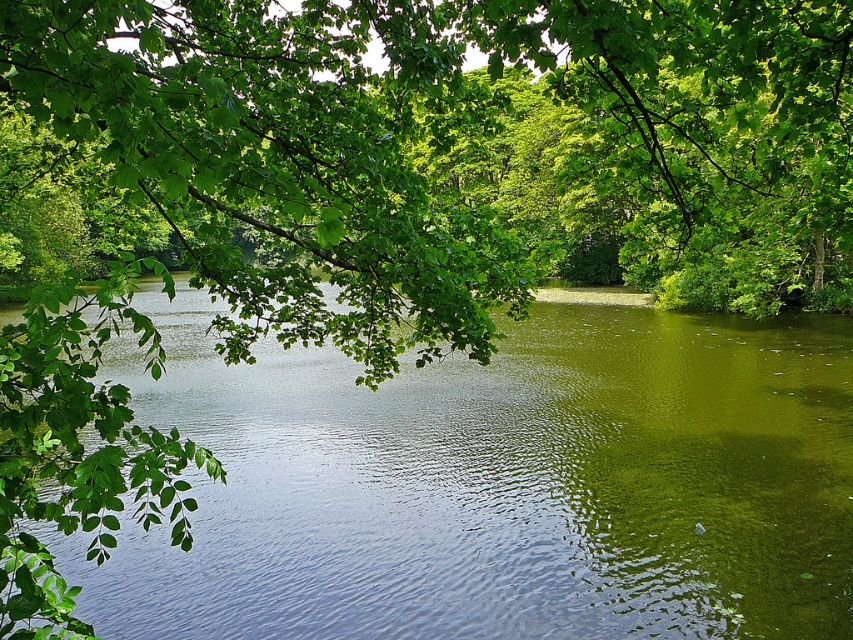
Does green leafy branch at upper center have a larger size compared to green smooth water at center?

Yes, green leafy branch at upper center is bigger than green smooth water at center.

Can you confirm if green leafy branch at upper center is positioned below green smooth water at center?

No, green leafy branch at upper center is not below green smooth water at center.

This screenshot has width=853, height=640. What do you see at coordinates (451, 147) in the screenshot?
I see `green leafy branch at upper center` at bounding box center [451, 147].

In order to click on green leafy branch at upper center in this screenshot , I will do `click(451, 147)`.